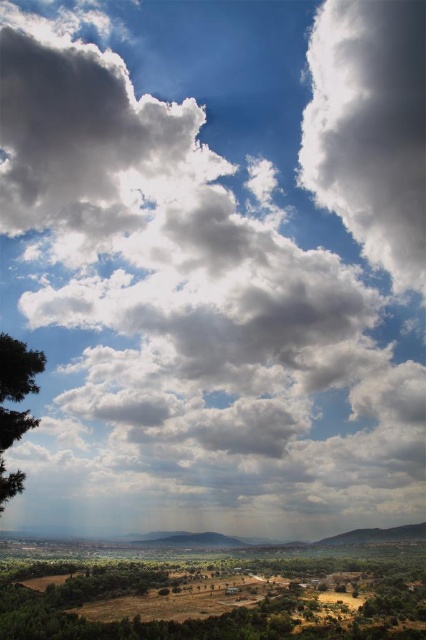
You are standing in the landscape scene and want to take a photo of the brown textured tree at lower left and the green matte tree at left. Which tree is closer to the camera?

The brown textured tree at lower left is positioned under the green matte tree at left, meaning it is closer to the camera.